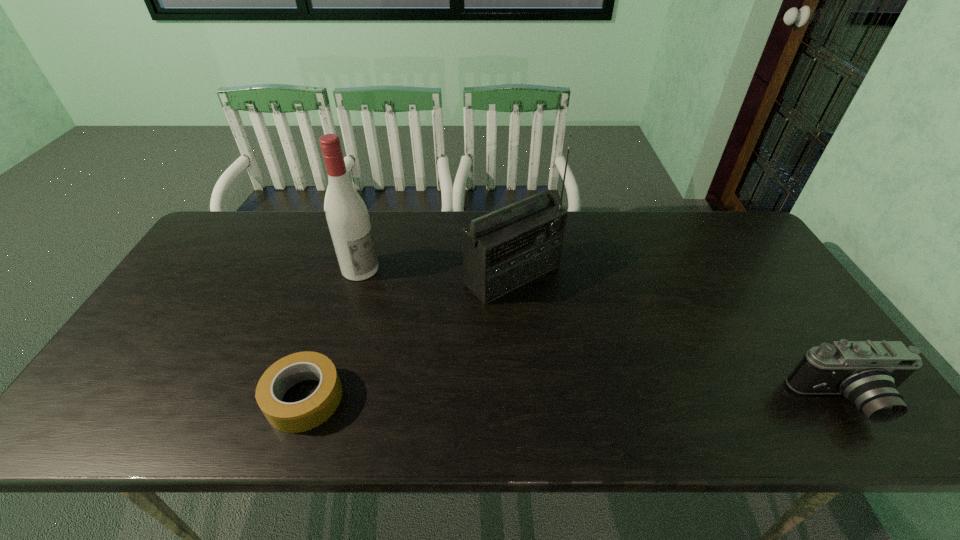
The width and height of the screenshot is (960, 540). In order to click on free space on the desktop that is between the duct tape and the rightmost object and is positioned on the label of the alcohol in this screenshot , I will do `click(589, 400)`.

I want to click on vacant spot on the desktop that is between the duct tape and the camera and is positioned on the front panel of the second object from right to left, so click(655, 401).